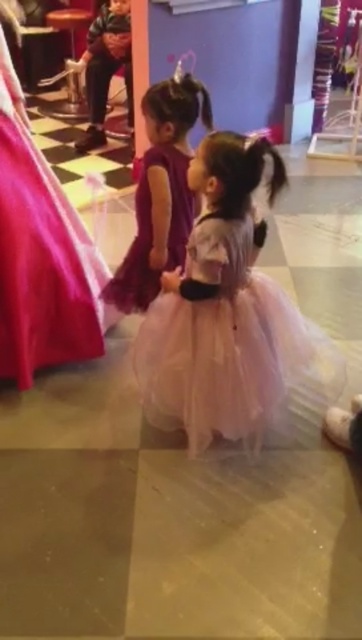
Question: Among these objects, which one is nearest to the camera?

Choices:
 (A) purple tulle dress at left
 (B) purple tulle dress at center
 (C) pink tulle dress at center

Answer: (C)

Question: Which object is positioned farthest from the pink tulle dress at center?

Choices:
 (A) purple tulle dress at left
 (B) purple tulle dress at center

Answer: (A)

Question: Which object is farther from the camera taking this photo?

Choices:
 (A) purple tulle dress at center
 (B) purple tulle dress at left
 (C) pink tulle dress at center

Answer: (A)

Question: Can you confirm if purple tulle dress at left is thinner than purple tulle dress at center?

Choices:
 (A) no
 (B) yes

Answer: (B)

Question: Does pink tulle dress at center have a greater width compared to purple tulle dress at left?

Choices:
 (A) no
 (B) yes

Answer: (B)

Question: Is purple tulle dress at left positioned at the back of purple tulle dress at center?

Choices:
 (A) no
 (B) yes

Answer: (A)